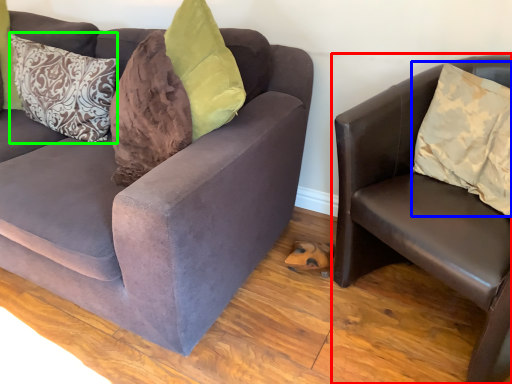
Question: Based on their relative distances, which object is nearer to studio couch (highlighted by a red box)? Choose from pillow (highlighted by a blue box) and pillow (highlighted by a green box).

Choices:
 (A) pillow
 (B) pillow

Answer: (A)